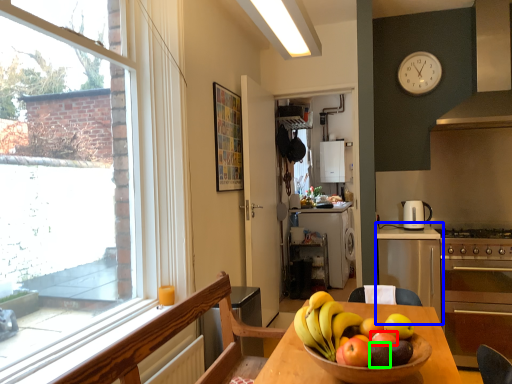
Question: Which is farther away from apple (highlighted by a red box)? cabinetry (highlighted by a blue box) or apple (highlighted by a green box)?

Choices:
 (A) cabinetry
 (B) apple

Answer: (A)